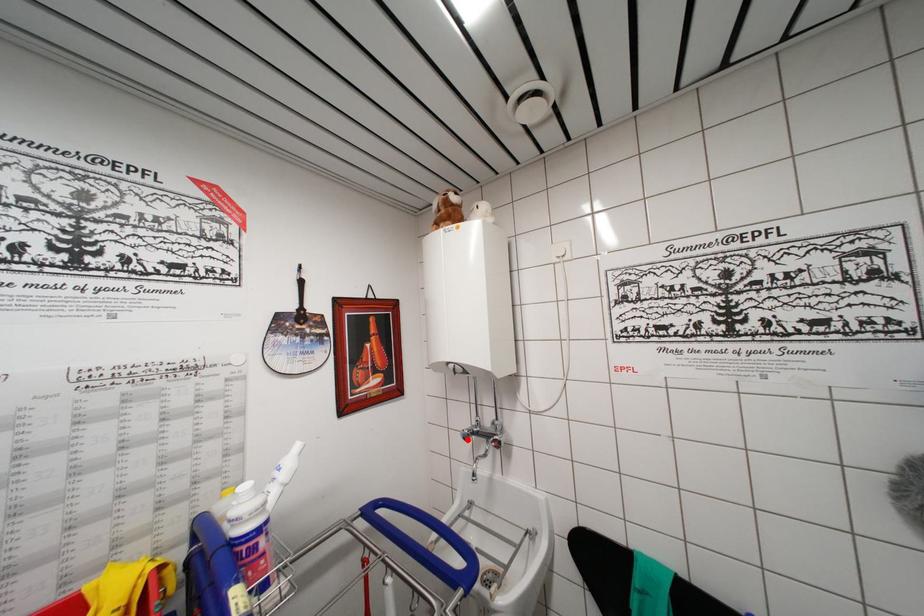
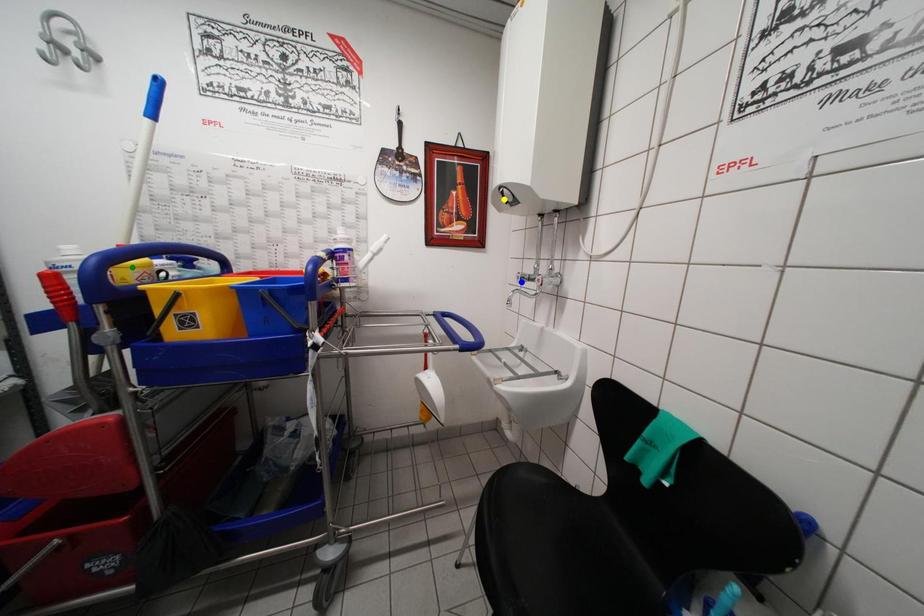
Question: I am providing you with two images of the same scene from different viewpoints. A red point is marked on the first image. You are given multiple points on the second image. In image 2, which mark is for the same physical point as the one in image 1?

Choices:
 (A) blue point
 (B) yellow point
 (C) green point

Answer: (A)